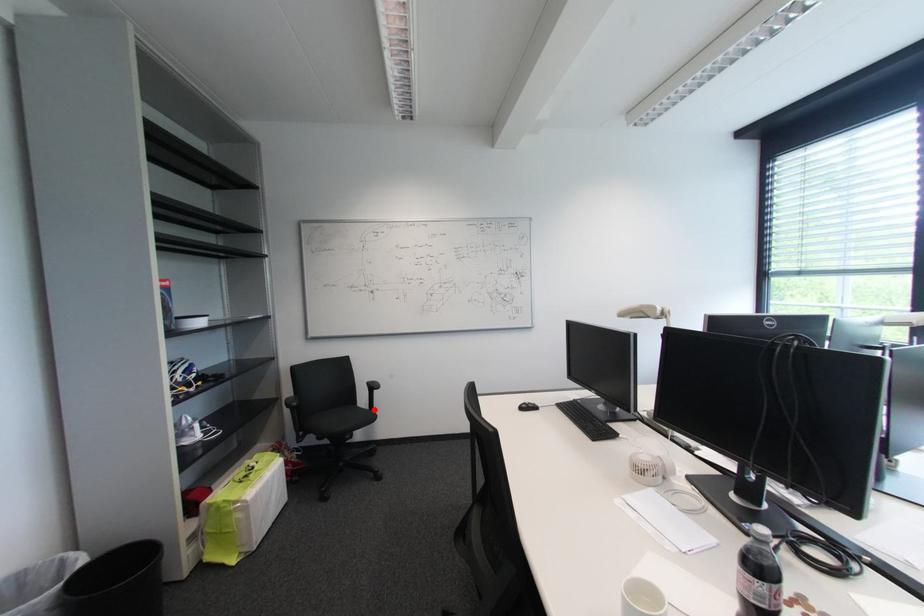
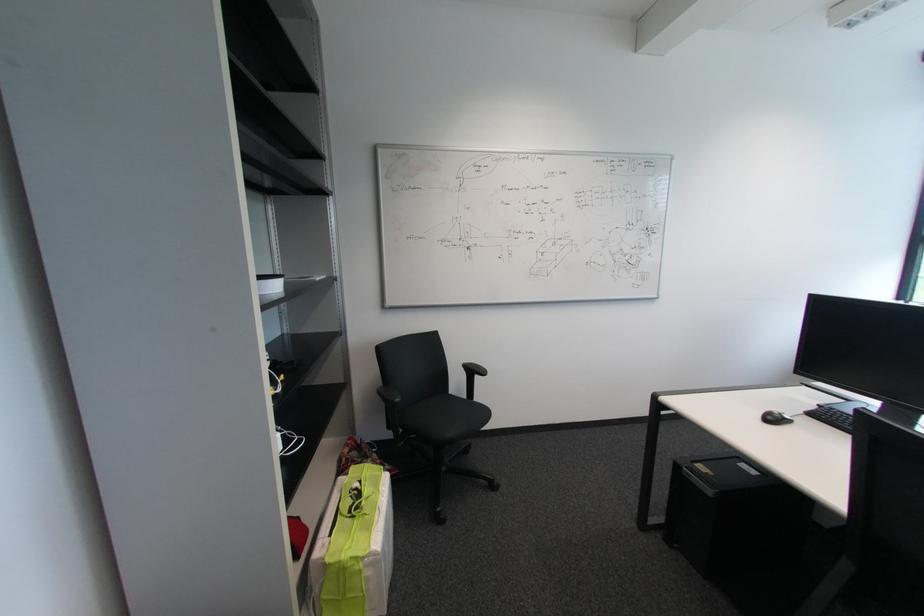
In the second image, find the point that corresponds to the highlighted location in the first image.

(471, 399)